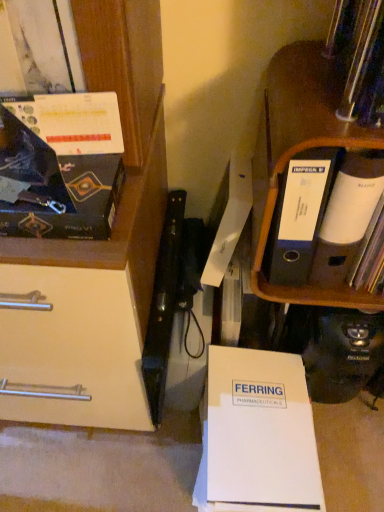
Where is `vacant area that is situated to the right of white paper at lower center`? vacant area that is situated to the right of white paper at lower center is located at coordinates (347, 456).